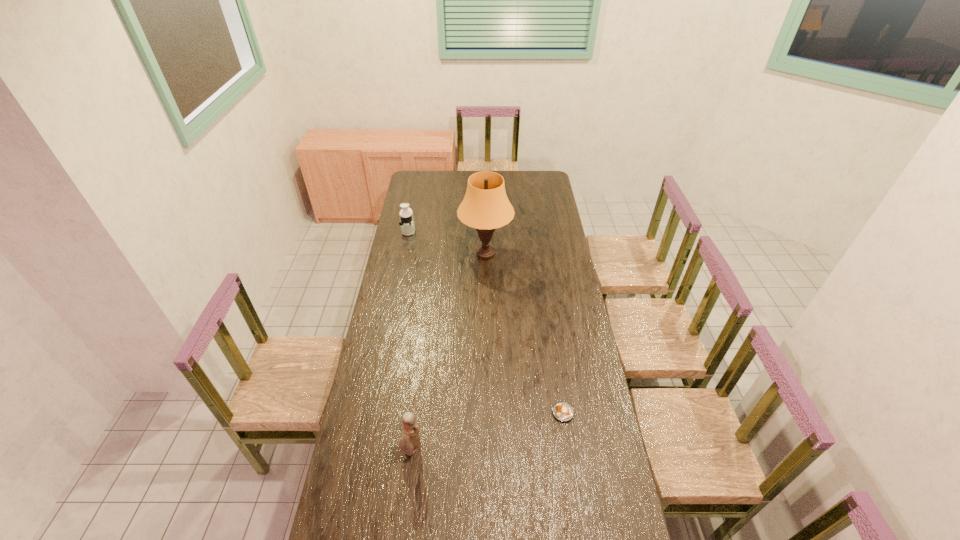
Find the location of a particular element. free space between the third tallest object and the third object from right to left is located at coordinates (410, 340).

Locate an element on the screen. The height and width of the screenshot is (540, 960). vacant region between the third farthest object and the leftmost object is located at coordinates (486, 322).

Where is `free space between the second tallest object and the third object from left to right`? free space between the second tallest object and the third object from left to right is located at coordinates (448, 352).

Find the location of a particular element. vacant region between the figurine and the tallest object is located at coordinates (448, 352).

Image resolution: width=960 pixels, height=540 pixels. What are the coordinates of `empty location between the third nearest object and the shortest object` in the screenshot? It's located at (524, 333).

Where is `vacant space that is in between the rightmost object and the nearest object`? vacant space that is in between the rightmost object and the nearest object is located at coordinates click(x=488, y=431).

Identify which object is located as the nearest to the juicer. Please provide its 2D coordinates. Your answer should be formatted as a tuple, i.e. [(x, y)], where the tuple contains the x and y coordinates of a point satisfying the conditions above.

[(485, 206)]

Locate an element on the screen. Image resolution: width=960 pixels, height=540 pixels. the third closest object to the farthest object is located at coordinates (562, 411).

Find the location of a particular element. free location that satisfies the following two spatial constraints: 1. on the front side of the tallest object; 2. on the right side of the leftmost object is located at coordinates (404, 254).